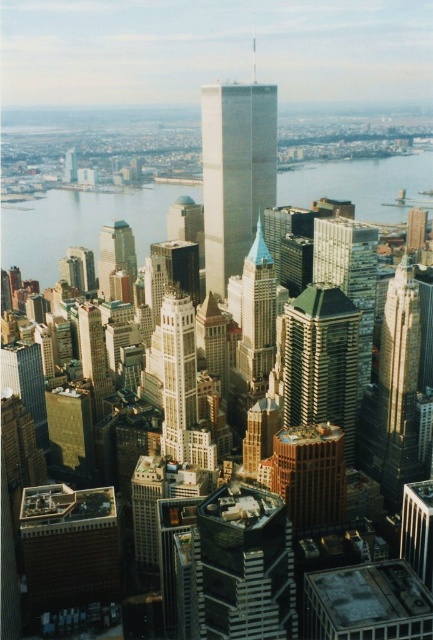
You are standing at the point closer to you in the cityscape image. If you look towards the point further away, which direction would you be facing? The two points are point A at coordinate point (323, 435) and point B at coordinate point (129, 266).

The point at coordinate point (323, 435) is further away from you than point B at coordinate point (129, 266). So, if you are standing at the closer point B, facing towards the further point A, you would be looking towards the direction of the tall skyscraper with a reflective facade since it is positioned in that area of the image.

You are a drone operator trying to capture a photo of the green glass building at center and the clear blue water at center. From your current position, which object is closer to you?

The clear blue water at center is further to the viewer than the green glass building at center, so the green glass building at center is closer to you.